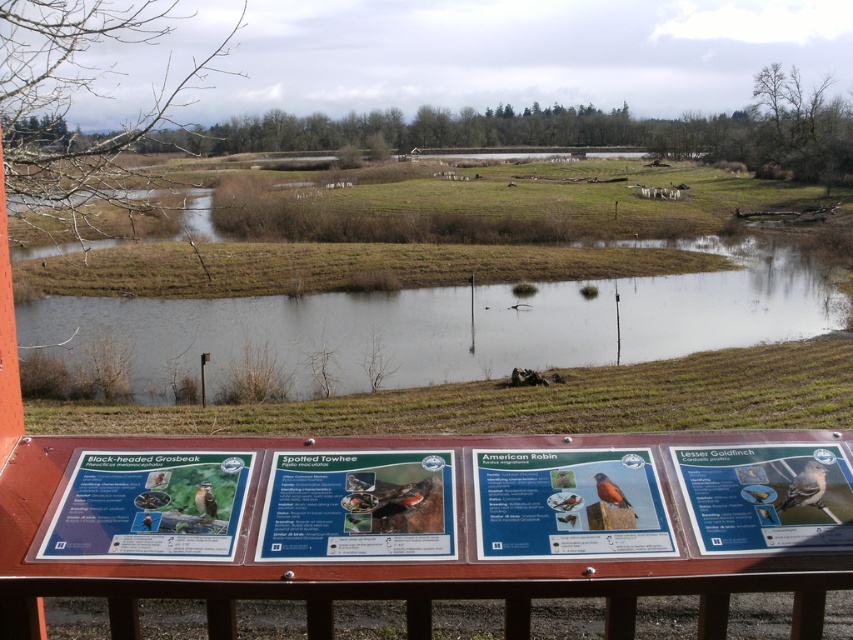
You are a photographer standing at the wooden railing with your camera. You want to capture a photo of the clear water at center and the brown feathered bird at lower left in the same frame. Which object should you focus on first if you want the wider subject to be in sharp focus?

The clear water at center has a greater width than the brown feathered bird at lower left. To ensure the wider subject is in sharp focus, you should focus on the clear water at center first.

You are standing at the viewing platform and want to observe a specific point in the wetland area. The point you want to reach is located at coordinates point (712, 333). Given that your binoculars have a maximum effective range of 30 meters, will you be able to clearly see the details of that point using your binoculars?

The distance of point (712, 333) from the camera is 32.44 meters. Since your binoculars have a maximum effective range of 30 meters, you will not be able to clearly see the details of that point using your binoculars.